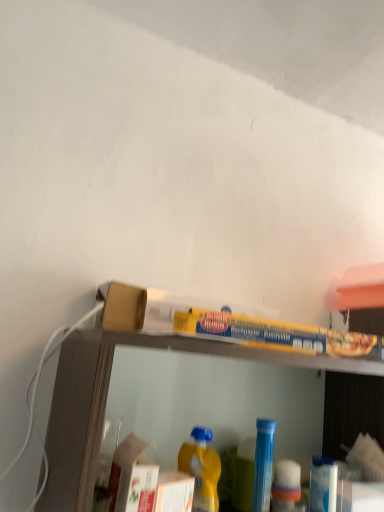
Question: Which direction should I rotate to look at blue plastic bottle at center, the 1th bottle positioned from the right, — up or down?

Choices:
 (A) down
 (B) up

Answer: (A)

Question: From the image's perspective, is clear plastic shelf at upper center on blue plastic bottle at center, marked as the second bottle in a front-to-back arrangement?

Choices:
 (A) no
 (B) yes

Answer: (B)

Question: Does clear plastic shelf at upper center appear on the left side of blue plastic bottle at center, the 1th bottle positioned from the right?

Choices:
 (A) no
 (B) yes

Answer: (B)

Question: Would you say blue plastic bottle at center, acting as the second bottle starting from the left, is part of clear plastic shelf at upper center's contents?

Choices:
 (A) no
 (B) yes

Answer: (B)

Question: Does clear plastic shelf at upper center come behind blue plastic bottle at center, acting as the second bottle starting from the left?

Choices:
 (A) yes
 (B) no

Answer: (B)

Question: Considering the relative positions of clear plastic shelf at upper center and blue plastic bottle at center, marked as the second bottle in a front-to-back arrangement, in the image provided, is clear plastic shelf at upper center to the right of blue plastic bottle at center, marked as the second bottle in a front-to-back arrangement, from the viewer's perspective?

Choices:
 (A) yes
 (B) no

Answer: (B)

Question: From a real-world perspective, is clear plastic shelf at upper center on top of blue plastic bottle at center, acting as the second bottle starting from the left?

Choices:
 (A) no
 (B) yes

Answer: (B)

Question: From a real-world perspective, is yellow matte plastic bottle at lower center, marked as the 1th bottle in a left-to-right arrangement, on clear plastic shelf at upper center?

Choices:
 (A) no
 (B) yes

Answer: (A)

Question: Is yellow matte plastic bottle at lower center, which is the 1th bottle in front-to-back order, bigger than clear plastic shelf at upper center?

Choices:
 (A) yes
 (B) no

Answer: (B)

Question: Is yellow matte plastic bottle at lower center, which is the 2th bottle from back to front, behind clear plastic shelf at upper center?

Choices:
 (A) no
 (B) yes

Answer: (B)

Question: Is yellow matte plastic bottle at lower center, which is the 1th bottle in front-to-back order, thinner than clear plastic shelf at upper center?

Choices:
 (A) yes
 (B) no

Answer: (A)

Question: Can you confirm if yellow matte plastic bottle at lower center, which is the 2th bottle from back to front, is positioned to the left of clear plastic shelf at upper center?

Choices:
 (A) yes
 (B) no

Answer: (A)

Question: Would you consider yellow matte plastic bottle at lower center, marked as the 1th bottle in a left-to-right arrangement, to be distant from clear plastic shelf at upper center?

Choices:
 (A) no
 (B) yes

Answer: (A)

Question: From the image's perspective, would you say clear plastic shelf at upper center is shown under yellow matte plastic bottle at lower center, marked as the 1th bottle in a left-to-right arrangement?

Choices:
 (A) no
 (B) yes

Answer: (A)